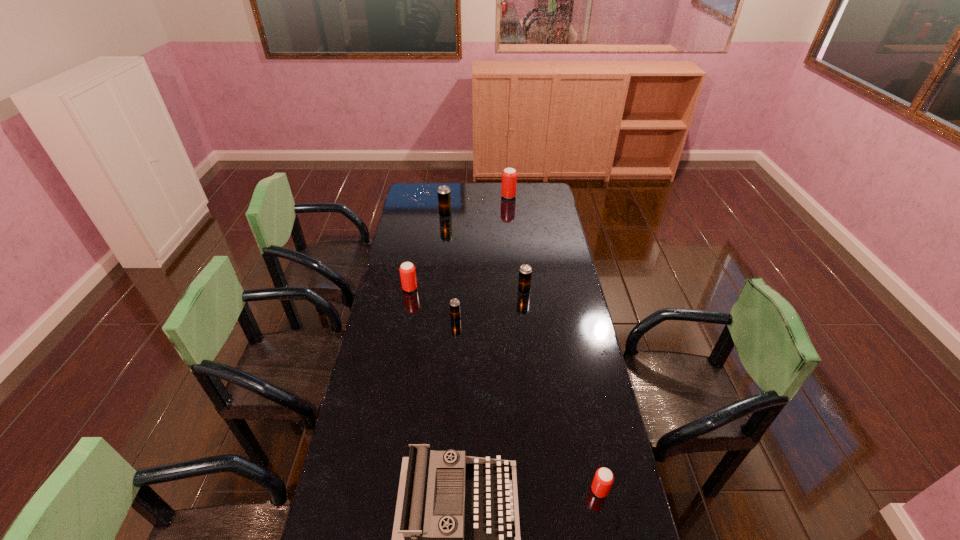
Identify the location of blank region between the sixth nearest object and the second red beer can from right to left. The width and height of the screenshot is (960, 540). (477, 206).

You are a GUI agent. You are given a task and a screenshot of the screen. Output one action in this format:
    pyautogui.click(x=<x>, y=<y>)
    Task: Click on the vacant space in between the nearest black beer can and the leftmost object
    
    Given the screenshot: What is the action you would take?
    pyautogui.click(x=433, y=303)

Locate an element on the screen. Image resolution: width=960 pixels, height=540 pixels. object that is the fourth nearest to the second biggest black beer can is located at coordinates (509, 175).

Identify the location of object identified as the sixth closest to the rightmost black beer can. (603, 479).

In order to click on the closest beer can to the rightmost black beer can in this screenshot , I will do [454, 303].

Select which beer can appears as the closest to the second farthest black beer can. Please provide its 2D coordinates. Your answer should be formatted as a tuple, i.e. [(x, y)], where the tuple contains the x and y coordinates of a point satisfying the conditions above.

[(454, 303)]

You are a GUI agent. You are given a task and a screenshot of the screen. Output one action in this format:
    pyautogui.click(x=<x>, y=<y>)
    Task: Click on the red beer can that stands as the second closest to the typewriter
    The width and height of the screenshot is (960, 540).
    Given the screenshot: What is the action you would take?
    pyautogui.click(x=407, y=270)

Image resolution: width=960 pixels, height=540 pixels. In order to click on red beer can that can be found as the closest to the second biggest black beer can in this screenshot , I will do click(x=407, y=270).

Where is `black beer can object that ranks as the closest to the nearest beer can`? This screenshot has height=540, width=960. black beer can object that ranks as the closest to the nearest beer can is located at coordinates (454, 303).

This screenshot has width=960, height=540. I want to click on the second closest black beer can to the second biggest black beer can, so click(444, 194).